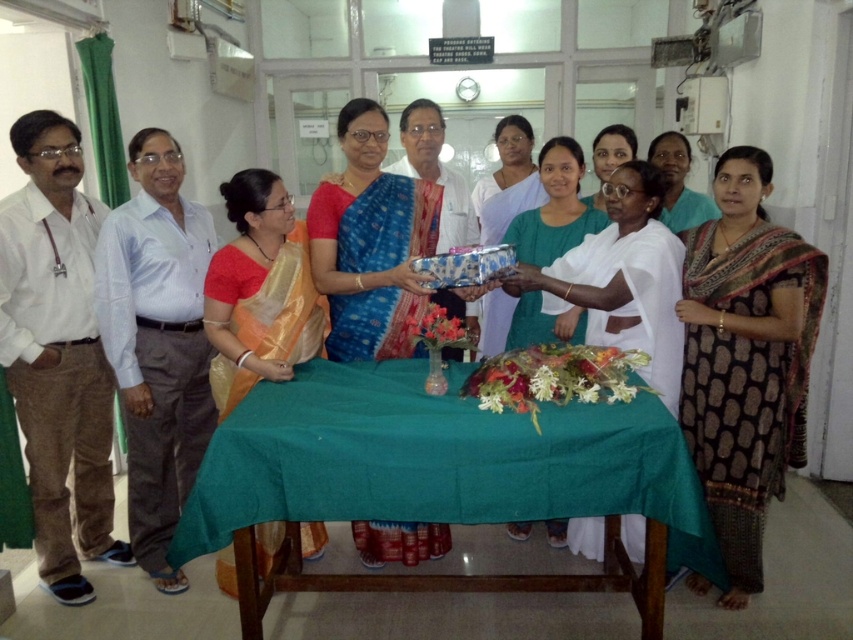
Question: Which object is the closest to the shiny metallic gift at center?

Choices:
 (A) light blue shirt at center
 (B) matte white saree at center

Answer: (A)

Question: Observing the image, what is the correct spatial positioning of white cotton shirt at left in reference to light blue shirt at center?

Choices:
 (A) right
 (B) left

Answer: (B)

Question: Which of these objects is positioned farthest from the blue silk saree at center?

Choices:
 (A) white cotton shirt at left
 (B) light blue shirt at center
 (C) shiny silver bowl at center
 (D) matte blue saree at center

Answer: (A)

Question: Can you confirm if white cotton shirt at left is positioned to the right of matte white saree at center?

Choices:
 (A) no
 (B) yes

Answer: (A)

Question: Which point is closer to the camera?

Choices:
 (A) matte blue saree at center
 (B) matte white saree at center
 (C) blue silk saree at center
 (D) green fabric-covered table at center

Answer: (D)

Question: In this image, where is blue silk saree at center located relative to shiny metallic gift at center?

Choices:
 (A) below
 (B) above

Answer: (B)